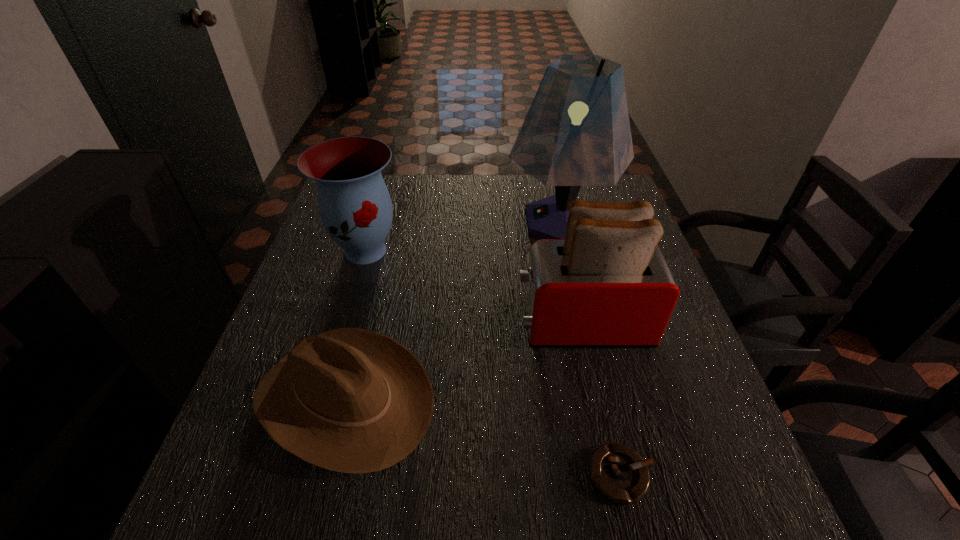
Where is `vacant space that is in between the vase and the ashtray`? The height and width of the screenshot is (540, 960). vacant space that is in between the vase and the ashtray is located at coordinates tap(493, 363).

Choose which object is the fourth nearest neighbor to the lampshade. Please provide its 2D coordinates. Your answer should be formatted as a tuple, i.e. [(x, y)], where the tuple contains the x and y coordinates of a point satisfying the conditions above.

[(619, 473)]

Locate which object is the third closest to the cowboy hat. Please provide its 2D coordinates. Your answer should be formatted as a tuple, i.e. [(x, y)], where the tuple contains the x and y coordinates of a point satisfying the conditions above.

[(619, 473)]

Identify the location of free space that satisfies the following two spatial constraints: 1. on the base of the ashtray; 2. on the left side of the tallest object. This screenshot has height=540, width=960. (620, 475).

Image resolution: width=960 pixels, height=540 pixels. What are the coordinates of `blank area in the image that satisfies the following two spatial constraints: 1. on the base of the ashtray; 2. on the left side of the tallest object` in the screenshot? It's located at (620, 475).

You are a GUI agent. You are given a task and a screenshot of the screen. Output one action in this format:
    pyautogui.click(x=<x>, y=<y>)
    Task: Click on the free space that satisfies the following two spatial constraints: 1. on the front-facing side of the toaster; 2. on the front side of the cowboy hat
    The image size is (960, 540).
    Given the screenshot: What is the action you would take?
    pyautogui.click(x=599, y=399)

Where is `free space that satisfies the following two spatial constraints: 1. on the front-facing side of the toaster; 2. on the left side of the ashtray`? The image size is (960, 540). free space that satisfies the following two spatial constraints: 1. on the front-facing side of the toaster; 2. on the left side of the ashtray is located at coordinates pyautogui.click(x=616, y=475).

Where is `free space that satisfies the following two spatial constraints: 1. on the base of the tallest object; 2. on the back side of the shortest object`? Image resolution: width=960 pixels, height=540 pixels. free space that satisfies the following two spatial constraints: 1. on the base of the tallest object; 2. on the back side of the shortest object is located at coordinates coord(620,475).

The width and height of the screenshot is (960, 540). In order to click on free space that satisfies the following two spatial constraints: 1. on the front side of the ashtray; 2. on the right side of the vase in this screenshot , I will do `click(300, 475)`.